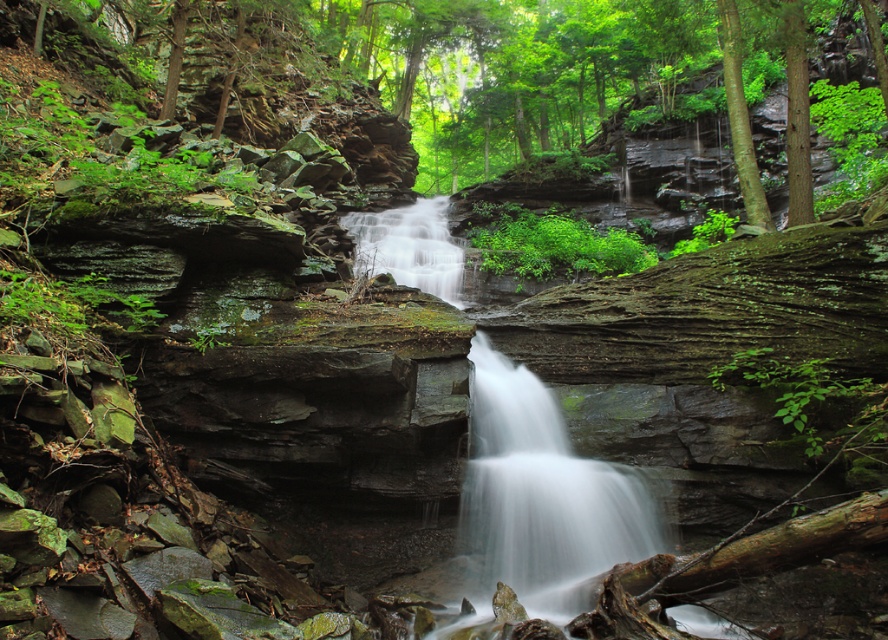
You are standing in the forest and want to reach a hidden treasure located at point (593, 534). You are currently at point (444, 250). Which direction should you move to get closer to the treasure?

To reach the treasure at point (593, 534) from your current position at point (444, 250), you should move away from the viewer since point (593, 534) is further away from the viewer than point (444, 250).

You are standing in the forest and want to take a photo of the smooth gray rock waterfall at center. If your camera can focus on objects up to 15 feet away, will you need to move closer or farther away to capture the waterfall clearly?

The smooth gray rock waterfall at center is 16.25 feet away from you. Since your camera can focus up to 15 feet, you need to move closer to ensure the waterfall is within the camera range.

You are standing in the forest and see the smooth gray rock waterfall at center and the white smooth water at center. Which one is positioned to the left?

The smooth gray rock waterfall at center is positioned to the left of the white smooth water at center.